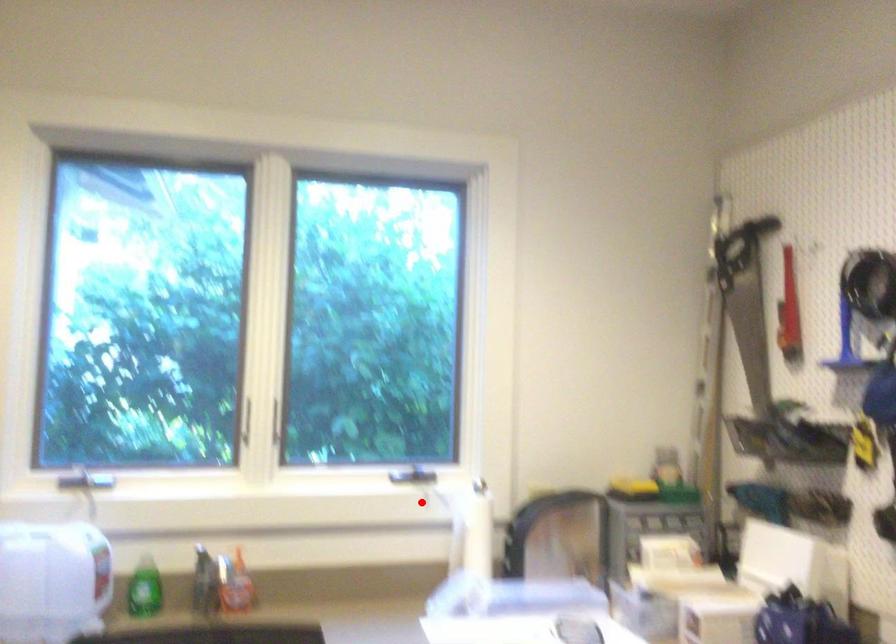
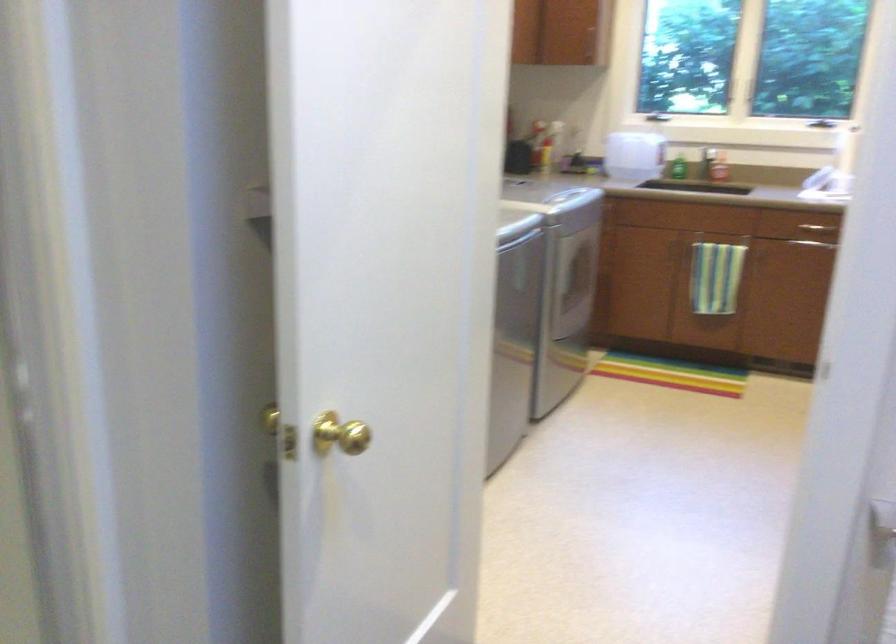
Locate, in the second image, the point that corresponds to the highlighted location in the first image.

(817, 122)